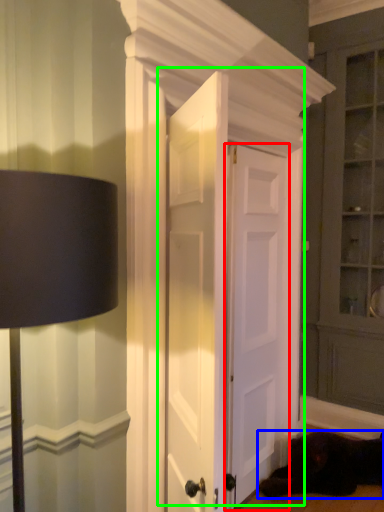
Question: Which is nearer to the door (highlighted by a red box)? dog (highlighted by a blue box) or door (highlighted by a green box).

Choices:
 (A) dog
 (B) door

Answer: (B)